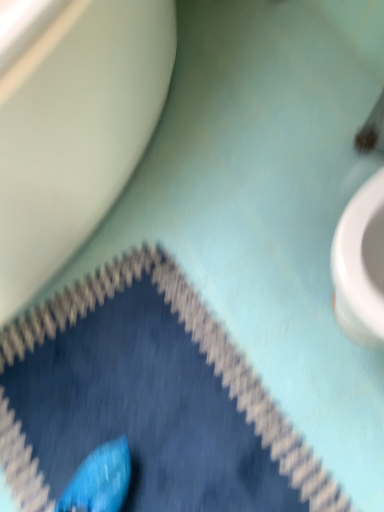
Measure the distance between blue fabric bath mat at lower left and camera.

The distance of blue fabric bath mat at lower left from camera is 35.24 inches.

The height and width of the screenshot is (512, 384). What are the coordinates of `blue fabric bath mat at lower left` in the screenshot? It's located at (146, 400).

What do you see at coordinates (146, 400) in the screenshot? The width and height of the screenshot is (384, 512). I see `blue fabric bath mat at lower left` at bounding box center [146, 400].

In order to click on blue fabric bath mat at lower left in this screenshot , I will do `click(146, 400)`.